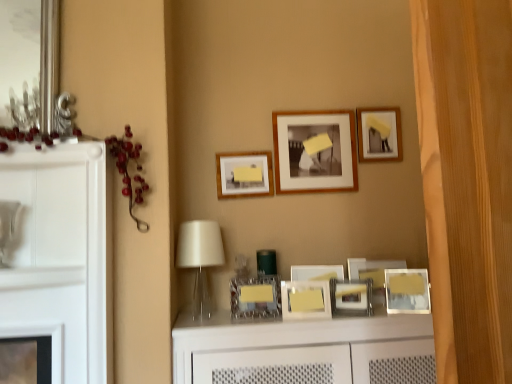
Where is `vacant area that is in front of metallic silver picture frame at center, which is the 1th picture frame in bottom-to-top order`? The width and height of the screenshot is (512, 384). vacant area that is in front of metallic silver picture frame at center, which is the 1th picture frame in bottom-to-top order is located at coordinates (356, 321).